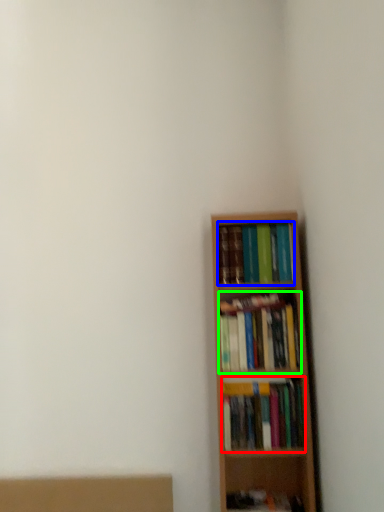
Question: Based on their relative distances, which object is farther from book (highlighted by a red box)? Choose from book (highlighted by a blue box) and book (highlighted by a green box).

Choices:
 (A) book
 (B) book

Answer: (A)